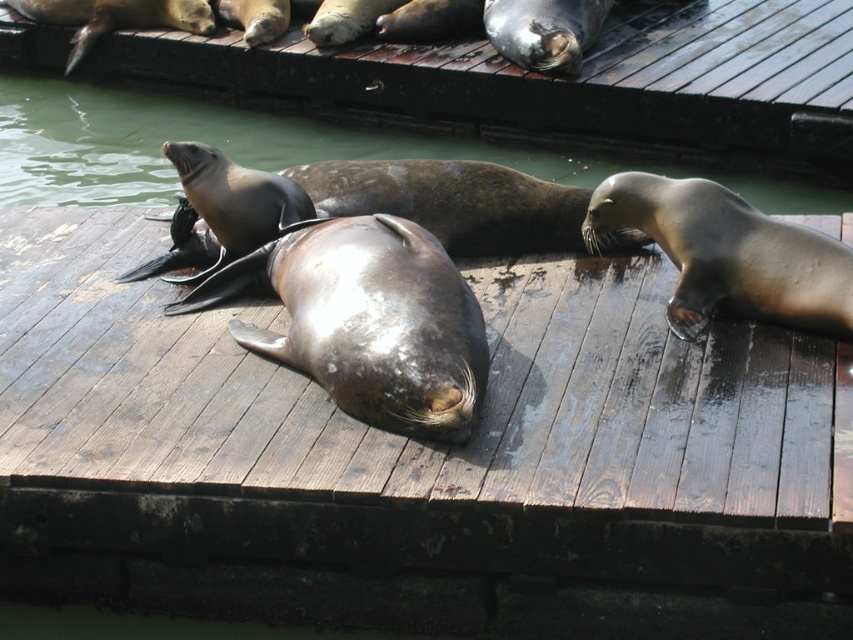
Does dark brown wooden dock at center appear over glossy water at center?

Incorrect, dark brown wooden dock at center is not positioned above glossy water at center.

What do you see at coordinates (410, 440) in the screenshot? I see `dark brown wooden dock at center` at bounding box center [410, 440].

Who is more distant from viewer, (53,326) or (91,195)?

The point (91,195) is behind.

Where is `dark brown wooden dock at center`? This screenshot has height=640, width=853. dark brown wooden dock at center is located at coordinates (410, 440).